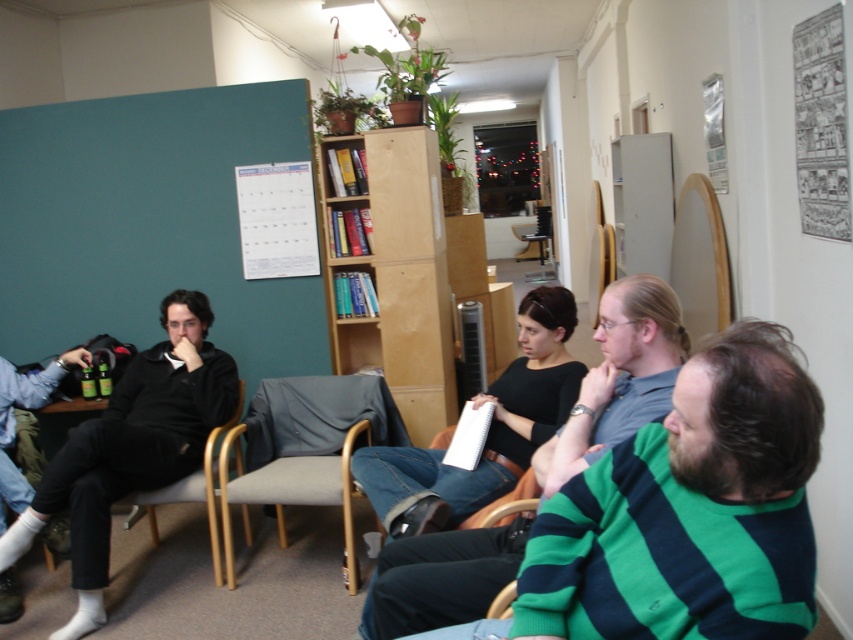
Question: Can you confirm if black matte clothing at left is positioned above light brown wood armchair at left?

Choices:
 (A) no
 (B) yes

Answer: (B)

Question: Among these objects, which one is farthest from the camera?

Choices:
 (A) gray fabric armchair at center
 (B) green striped sweater at center
 (C) black matte clothing at left

Answer: (A)

Question: Which of these objects is positioned closest to the gray fabric armchair at center?

Choices:
 (A) bare wood bookshelf at center
 (B) green striped sweater at center

Answer: (A)

Question: Can you confirm if green striped sweater at center is positioned above light brown wood armchair at left?

Choices:
 (A) yes
 (B) no

Answer: (A)

Question: Can you confirm if gray fabric armchair at center is positioned to the right of light brown wood armchair at left?

Choices:
 (A) yes
 (B) no

Answer: (A)

Question: Estimate the real-world distances between objects in this image. Which object is closer to the light brown wood armchair at left?

Choices:
 (A) gray fabric armchair at center
 (B) black matte clothing at left
 (C) green striped sweater at center
 (D) matte black pants at left

Answer: (B)